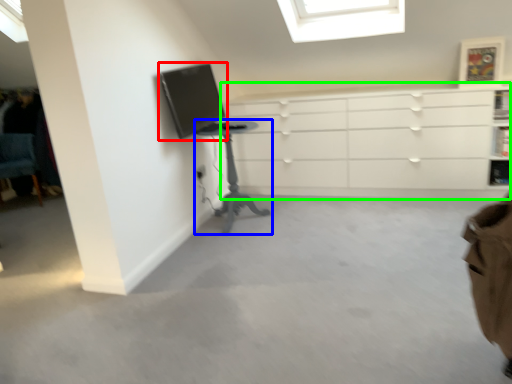
Question: Estimate the real-world distances between objects in this image. Which object is farther from computer monitor (highlighted by a red box), table (highlighted by a blue box) or chest of drawers (highlighted by a green box)?

Choices:
 (A) table
 (B) chest of drawers

Answer: (B)